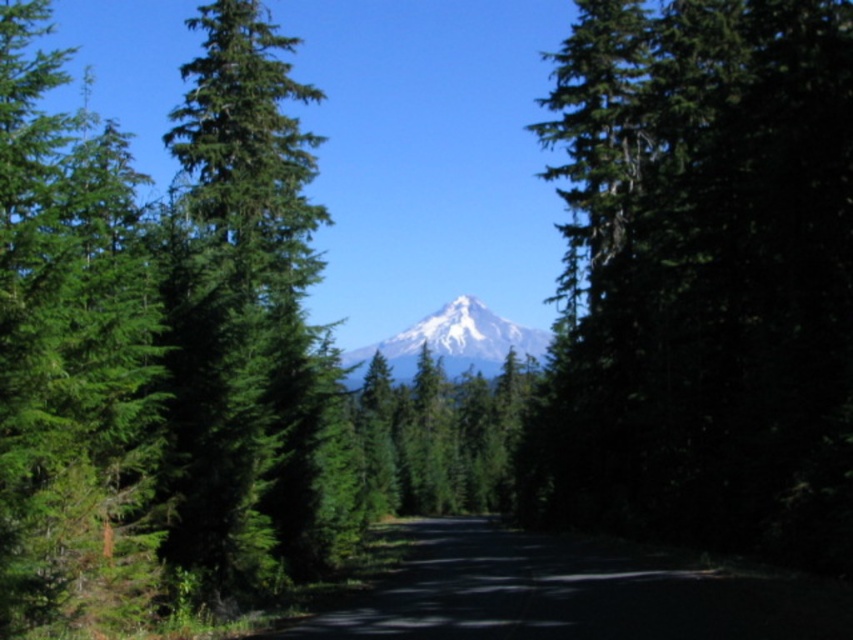
Question: Considering the relative positions of green matte tree at right and white snow-covered mountain at center in the image provided, where is green matte tree at right located with respect to white snow-covered mountain at center?

Choices:
 (A) above
 (B) below

Answer: (A)

Question: Which point is closer to the camera?

Choices:
 (A) (251, 33)
 (B) (466, 298)

Answer: (A)

Question: Does green matte tree at right appear over green needle-like tree at left?

Choices:
 (A) yes
 (B) no

Answer: (B)

Question: Which object is farther from the camera taking this photo?

Choices:
 (A) white snow-covered mountain at center
 (B) green matte tree at right

Answer: (A)

Question: Is green matte tree at right to the right of white snow-covered mountain at center from the viewer's perspective?

Choices:
 (A) yes
 (B) no

Answer: (A)

Question: Which point is farther to the camera?

Choices:
 (A) white snow-covered mountain at center
 (B) green needle-like tree at left
 (C) green matte tree at right

Answer: (A)